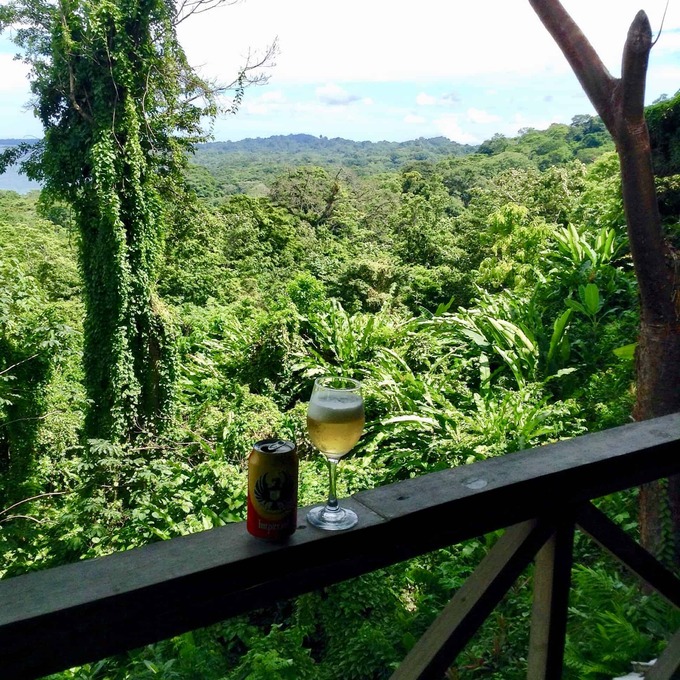
The height and width of the screenshot is (680, 680). In order to click on handle in this screenshot , I will do `click(332, 479)`.